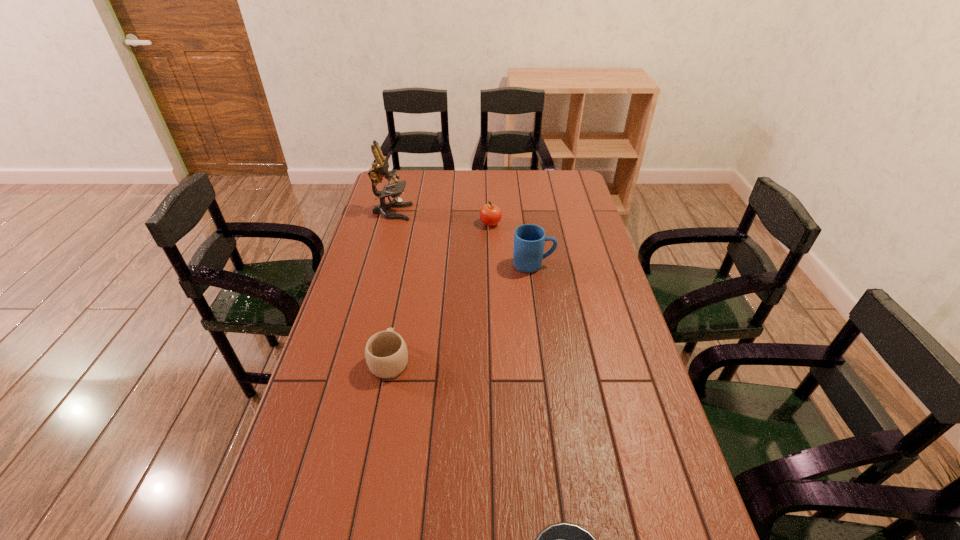
Locate an element on the screen. The height and width of the screenshot is (540, 960). vacant point that satisfies the following two spatial constraints: 1. on the side of the nearer mug with the handle; 2. at the eyepieces of the microscope is located at coordinates (419, 212).

Image resolution: width=960 pixels, height=540 pixels. I want to click on vacant space that satisfies the following two spatial constraints: 1. at the eyepieces of the apple; 2. on the left side of the microscope, so click(389, 224).